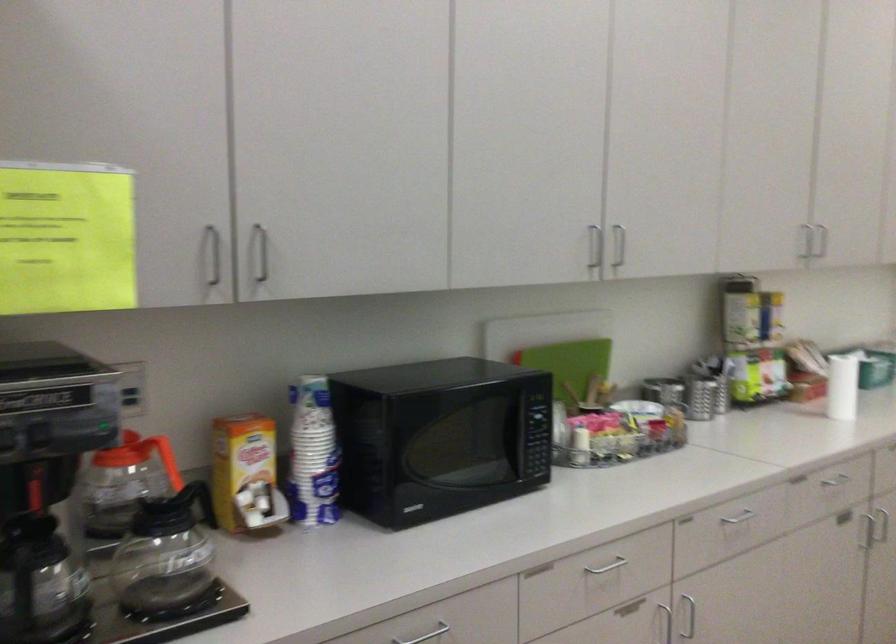
Which object does [313,453] point to?

It refers to a stacked paper cups.